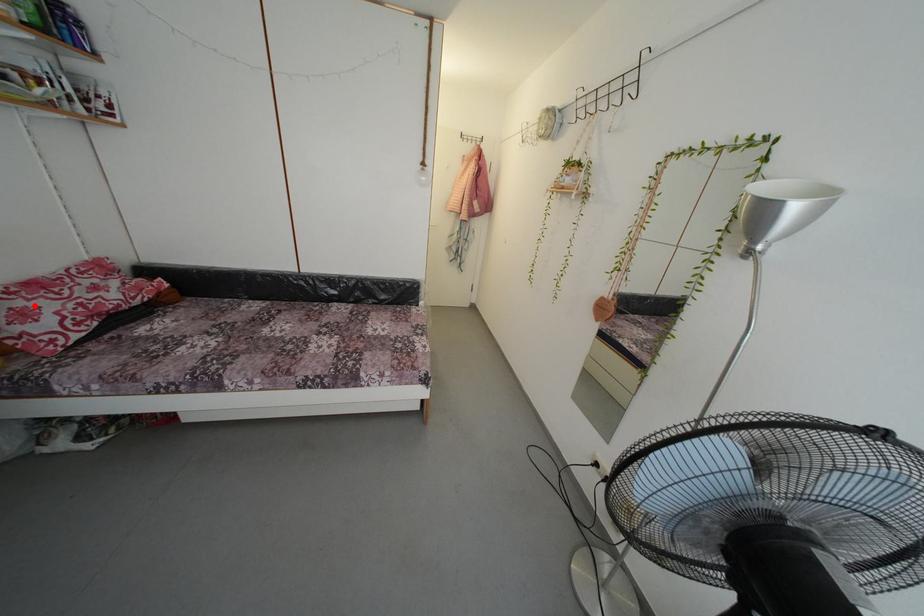
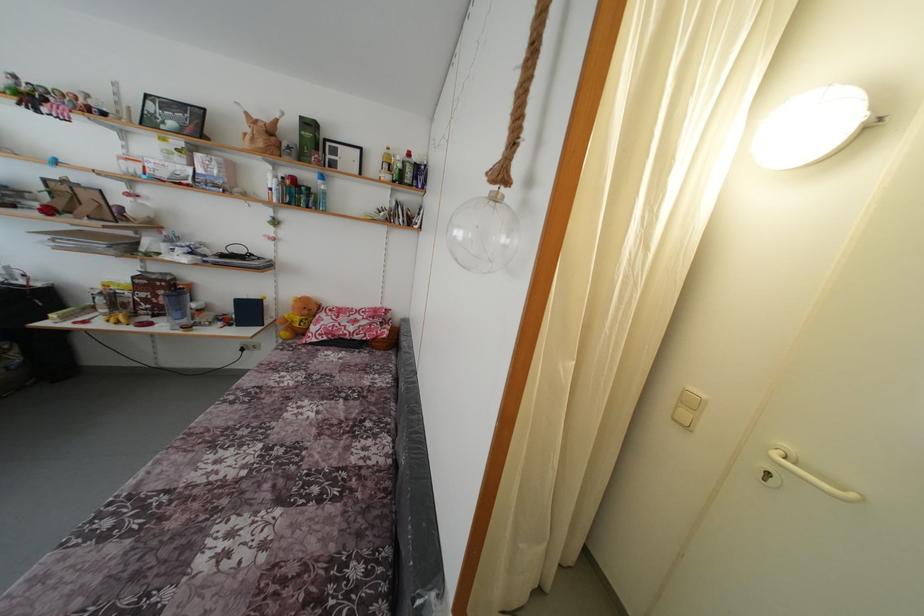
Question: I am providing you with two images of the same scene from different viewpoints. Image1 has a red point marked. In image2, the corresponding 3D location appears at what relative position? Reply with the corresponding letter.

Choices:
 (A) Closer
 (B) Farther

Answer: (A)